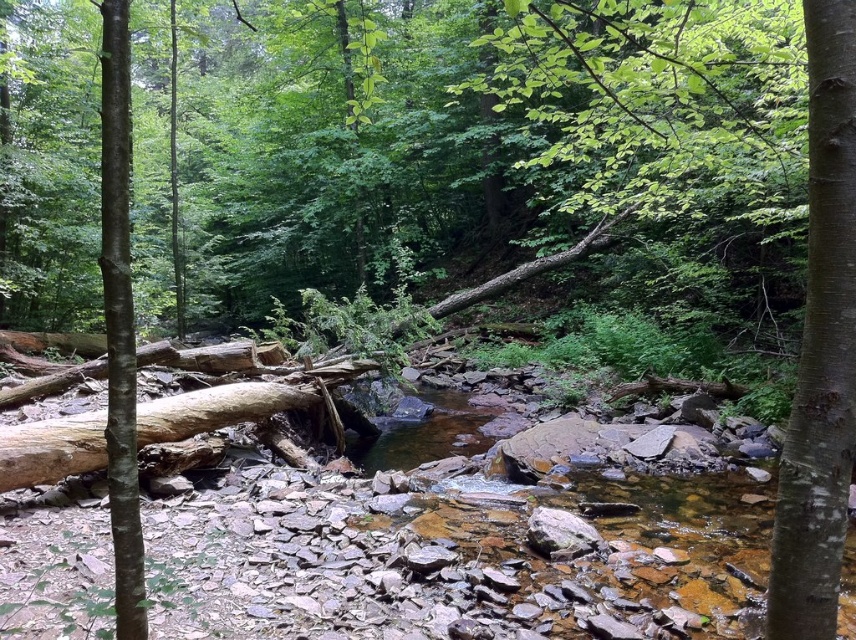
Does white smooth tree trunk at center have a smaller size compared to smooth brown tree trunk at left?

Correct, white smooth tree trunk at center occupies less space than smooth brown tree trunk at left.

Which is behind, point (801, 538) or point (104, 138)?

Point (104, 138)

Is point (852, 184) closer to viewer compared to point (123, 432)?

Yes, point (852, 184) is in front of point (123, 432).

I want to click on white smooth tree trunk at center, so click(x=819, y=348).